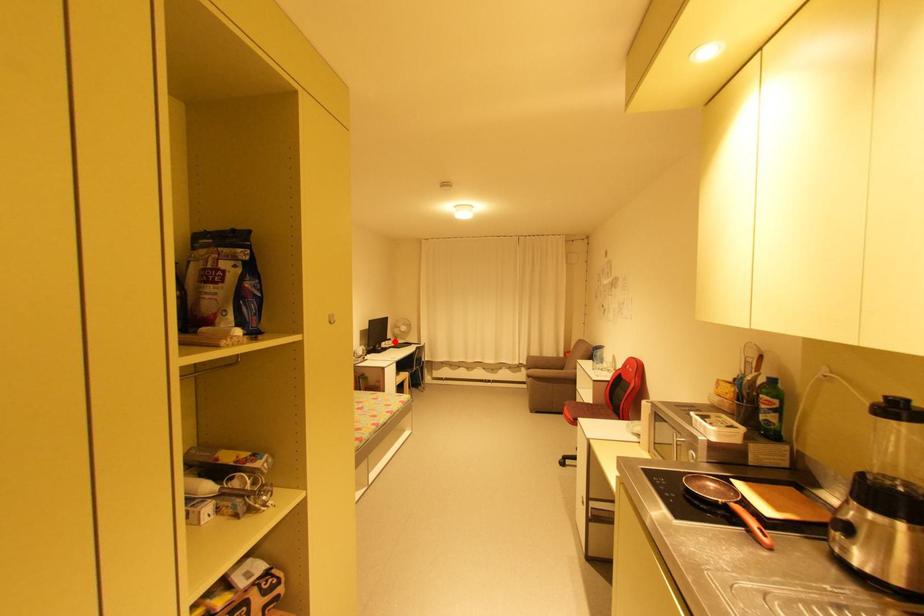
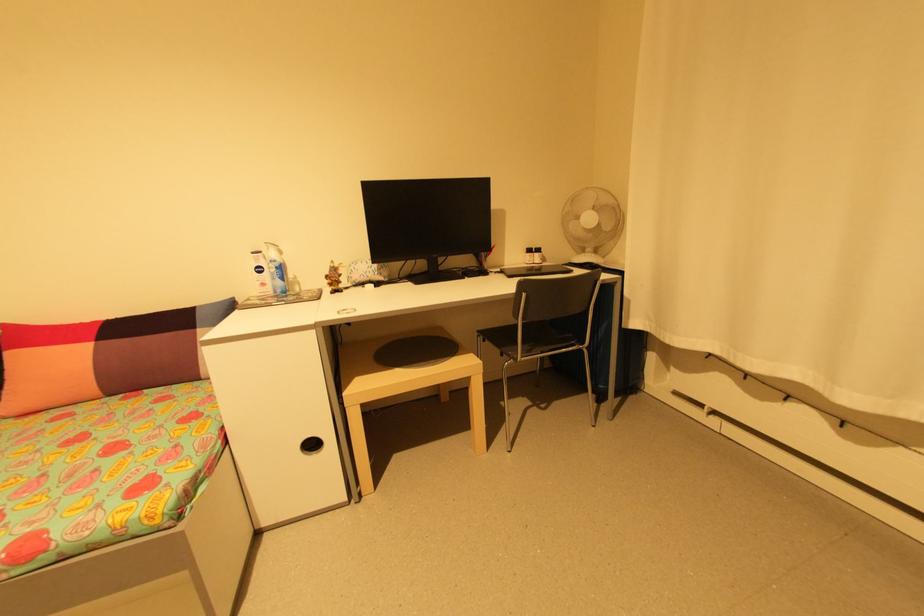
Find the pixel in the second image that matches the highlighted location in the first image.

(541, 254)